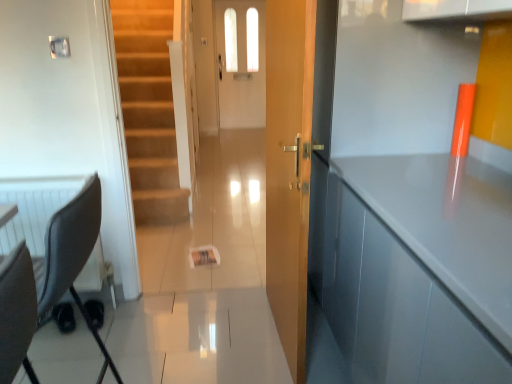
Find the location of a particular element. Image resolution: width=512 pixels, height=384 pixels. vacant space in front of wooden door at center is located at coordinates (268, 360).